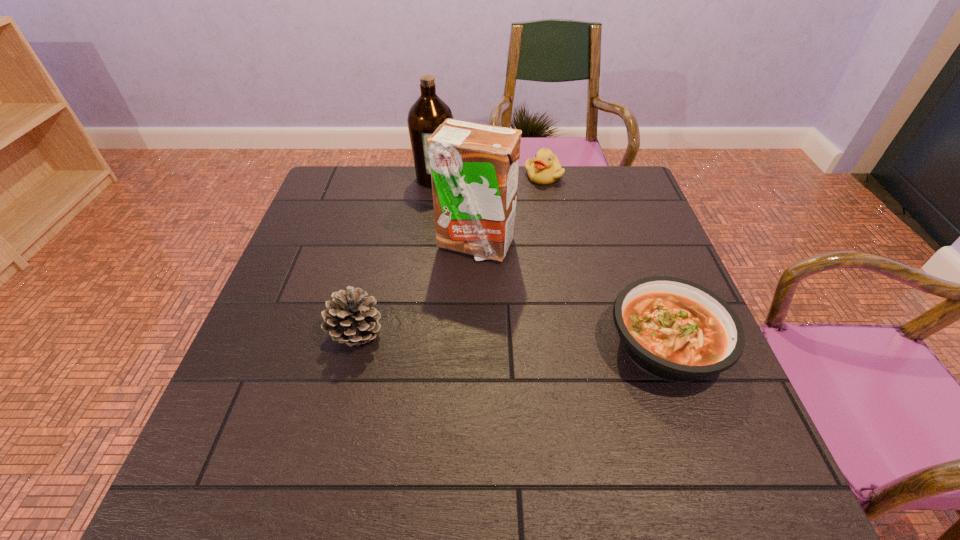
Locate an element on the screen. free spot between the stew and the carton is located at coordinates (570, 295).

Find the location of a particular element. The height and width of the screenshot is (540, 960). vacant space in between the third tallest object and the fourth object from left to right is located at coordinates pyautogui.click(x=450, y=254).

Locate an element on the screen. The width and height of the screenshot is (960, 540). free area in between the olive oil and the stew is located at coordinates (550, 262).

Choose which object is the nearest neighbor to the third tallest object. Please provide its 2D coordinates. Your answer should be formatted as a tuple, i.e. [(x, y)], where the tuple contains the x and y coordinates of a point satisfying the conditions above.

[(474, 167)]

Identify which object is the closest to the olive oil. Please provide its 2D coordinates. Your answer should be formatted as a tuple, i.e. [(x, y)], where the tuple contains the x and y coordinates of a point satisfying the conditions above.

[(474, 167)]

The height and width of the screenshot is (540, 960). Find the location of `vacant space that satisfies the following two spatial constraints: 1. on the front side of the stew; 2. on the left side of the carton`. vacant space that satisfies the following two spatial constraints: 1. on the front side of the stew; 2. on the left side of the carton is located at coordinates (473, 346).

Locate an element on the screen. vacant position in the image that satisfies the following two spatial constraints: 1. on the front side of the rightmost object; 2. on the right side of the third nearest object is located at coordinates (473, 346).

Locate an element on the screen. This screenshot has width=960, height=540. free space that satisfies the following two spatial constraints: 1. on the front side of the rightmost object; 2. on the left side of the olive oil is located at coordinates (414, 346).

In order to click on vacant space that satisfies the following two spatial constraints: 1. on the back side of the duckling; 2. on the right side of the pinecone in this screenshot , I will do `click(396, 176)`.